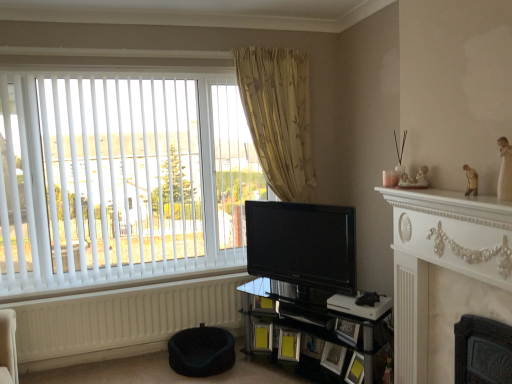
Question: Does point (382, 339) appear closer or farther from the camera than point (477, 206)?

Choices:
 (A) farther
 (B) closer

Answer: (A)

Question: Based on their sizes in the image, would you say black glass shelf at lower center is bigger or smaller than white marble fireplace at right?

Choices:
 (A) big
 (B) small

Answer: (A)

Question: Which object is the closest to the black glossy tv at center?

Choices:
 (A) white marble fireplace at right, the second fireplace in the bottom-to-top sequence
 (B) marble fireplace at right, the first fireplace positioned from the bottom
 (C) matte black picture frame at lower center, marked as the fourth picture frame in a right-to-left arrangement
 (D) beige floral fabric curtain at upper center
 (E) white matte radiator at lower left

Answer: (C)

Question: Based on their relative distances, which object is nearer to the matte black picture frame at lower center, positioned as the second picture frame in right-to-left order?

Choices:
 (A) matte black picture frame at lower center, marked as the fourth picture frame in a right-to-left arrangement
 (B) brown matte figurine at upper right
 (C) white vertical blinds at left
 (D) white matte radiator at lower left
 (E) matte yellow picture frame at lower center, the first picture frame viewed from the right

Answer: (E)